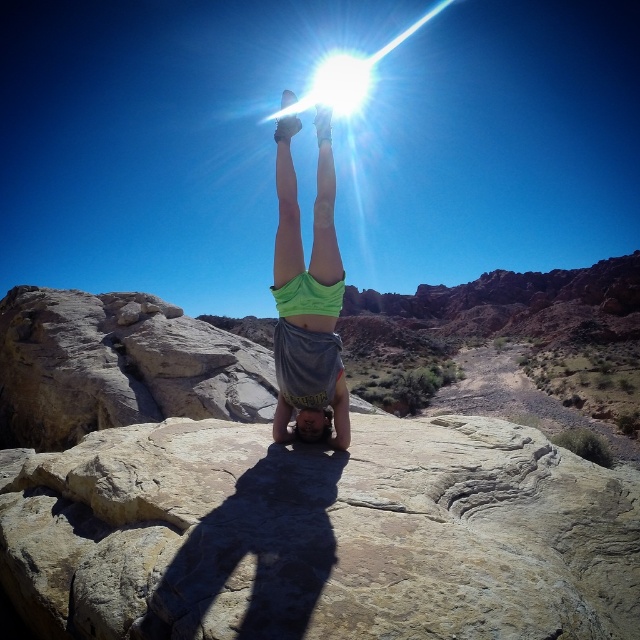
Describe the element at coordinates (321, 534) in the screenshot. I see `smooth beige rock at center` at that location.

Is smooth beige rock at center thinner than green fabric at center?

No.

You are a GUI agent. You are given a task and a screenshot of the screen. Output one action in this format:
    pyautogui.click(x=<x>, y=<y>)
    Task: Click on the smooth beige rock at center
    Image resolution: width=640 pixels, height=640 pixels.
    Given the screenshot: What is the action you would take?
    pyautogui.click(x=321, y=534)